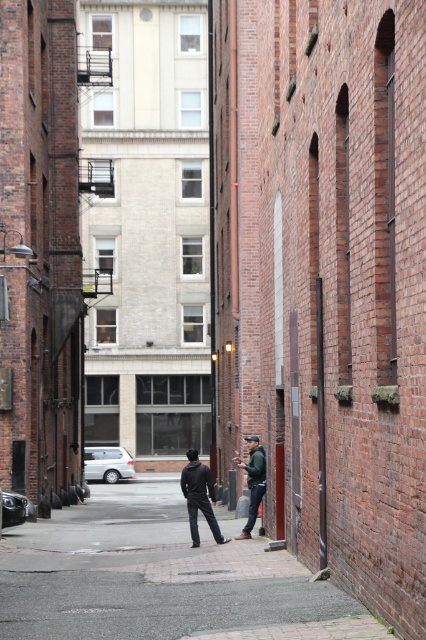
Can you confirm if black matte jacket at center is positioned to the right of green fabric jacket at center?

In fact, black matte jacket at center is to the left of green fabric jacket at center.

Between point (184, 481) and point (264, 456), which one is positioned in front?

Point (184, 481)

Where is `black matte jacket at center`? The height and width of the screenshot is (640, 426). black matte jacket at center is located at coordinates (198, 497).

Between point (178, 621) and point (241, 461), which one is positioned behind?

The point (241, 461) is more distant.

Is point (43, 552) more distant than point (252, 524)?

No, it is in front of (252, 524).

This screenshot has width=426, height=640. What are the coordinates of `dark gray asphalt at center` in the screenshot? It's located at (160, 577).

Does point (31, 524) lie in front of point (206, 486)?

No, (31, 524) is behind (206, 486).

Find the location of a particular element. The width and height of the screenshot is (426, 640). dark gray asphalt at center is located at coordinates (160, 577).